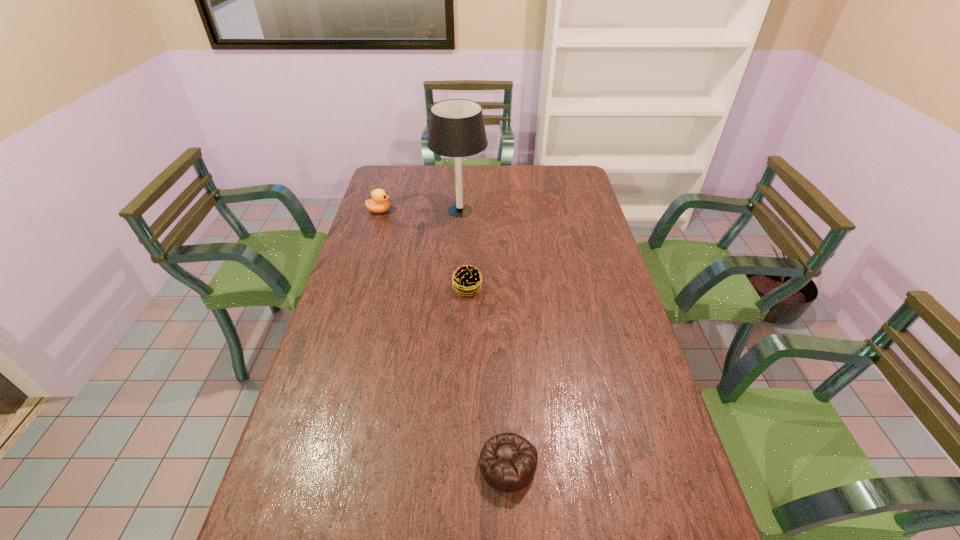
Locate an element on the screen. blank space located 0.400m on the back of the nearest object is located at coordinates point(501,316).

Where is `object at the left edge`? Image resolution: width=960 pixels, height=540 pixels. object at the left edge is located at coordinates (378, 203).

Find the location of a particular element. Image resolution: width=960 pixels, height=540 pixels. vacant space at the far edge is located at coordinates (463, 170).

Locate an element on the screen. vacant space at the left edge of the desktop is located at coordinates (369, 335).

Find the location of a particular element. The height and width of the screenshot is (540, 960). vacant space at the right edge is located at coordinates (593, 248).

The image size is (960, 540). I want to click on free point at the far left corner, so click(378, 174).

Identify the location of free space at the far right corner. This screenshot has height=540, width=960. (550, 174).

Locate an element on the screen. The height and width of the screenshot is (540, 960). unoccupied position between the second tallest object and the shortest object is located at coordinates (444, 338).

The width and height of the screenshot is (960, 540). In order to click on empty location between the duckling and the shortest object in this screenshot , I will do `click(444, 338)`.

This screenshot has width=960, height=540. In order to click on free space between the table lamp and the third shortest object in this screenshot , I will do `click(420, 211)`.